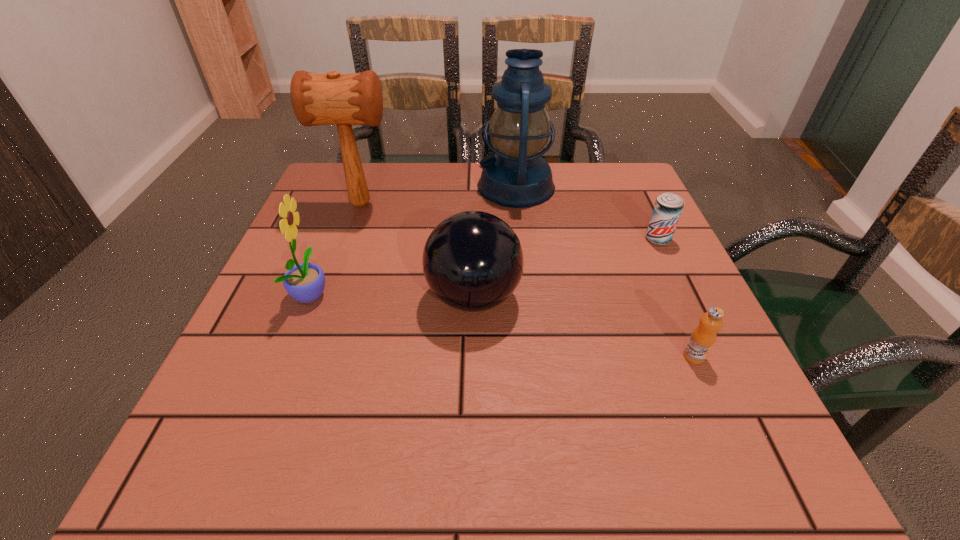
Image resolution: width=960 pixels, height=540 pixels. I want to click on blank region between the lantern and the sunflower, so click(x=414, y=240).

In order to click on vacant space in between the lantern and the fourth shortest object in this screenshot , I will do `click(414, 240)`.

The width and height of the screenshot is (960, 540). Identify the location of empty location between the lantern and the third tallest object. (414, 240).

You are a GUI agent. You are given a task and a screenshot of the screen. Output one action in this format:
    pyautogui.click(x=<x>, y=<y>)
    Task: Click on the free point between the mallet and the orange juice
    Image resolution: width=960 pixels, height=540 pixels.
    Given the screenshot: What is the action you would take?
    [527, 280]

Locate an element on the screen. Image resolution: width=960 pixels, height=540 pixels. vacant space in between the lantern and the mallet is located at coordinates (439, 195).

Find the location of a particular element. The width and height of the screenshot is (960, 540). free space that is in between the lantern and the third farthest object is located at coordinates tap(587, 213).

Locate an element on the screen. Image resolution: width=960 pixels, height=540 pixels. vacant space in between the mallet and the nearest object is located at coordinates (527, 280).

The height and width of the screenshot is (540, 960). Find the location of `object that ranks as the fourth closest to the mallet`. object that ranks as the fourth closest to the mallet is located at coordinates (668, 207).

Where is `the second closest object to the lantern`? This screenshot has width=960, height=540. the second closest object to the lantern is located at coordinates (668, 207).

The image size is (960, 540). I want to click on free space that satisfies the following two spatial constraints: 1. on the front side of the beer can; 2. on the front-facing side of the sunflower, so click(684, 293).